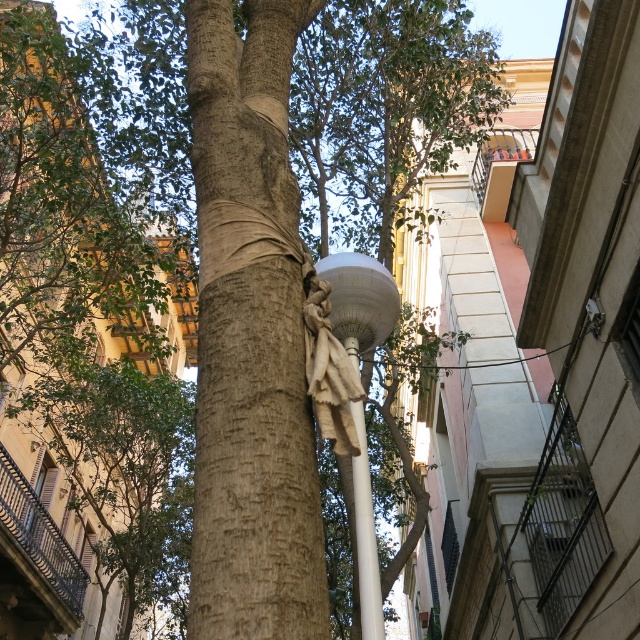
Consider the image. You are a painter standing in front of the tree trunk. You need to paint both the white matte lamp post at center and the white glossy pole at center. Which object should you paint first if you want to paint the one that is closer to you?

The white matte lamp post at center is positioned over the white glossy pole at center, so you should paint the white glossy pole at center first since it is closer to you.

You are a city planner assessing the safety of the street layout. The light brown bark tree trunk at center and the white glossy pole at center are both in the same area. Given that the minimum required distance between trees and street poles for safety is 5 meters, is the current spacing between them compliant with safety regulations?

The distance between the light brown bark tree trunk at center and the white glossy pole at center is 4.77 meters, which is less than the required 5 meters. Therefore, the current spacing does not comply with safety regulations.